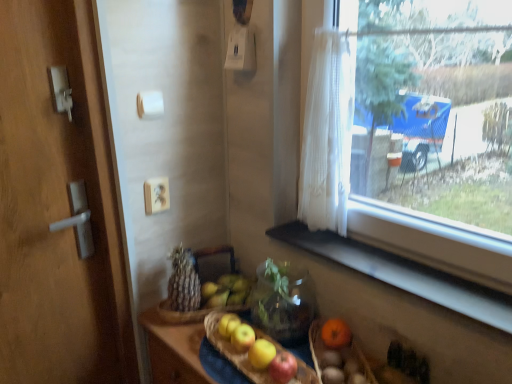
Question: Is there a large distance between black matte window sill at lower right and white sheer curtain at window?

Choices:
 (A) yes
 (B) no

Answer: (B)

Question: From a real-world perspective, does black matte window sill at lower right sit lower than white sheer curtain at window?

Choices:
 (A) yes
 (B) no

Answer: (A)

Question: Can you confirm if black matte window sill at lower right is positioned to the right of white sheer curtain at window?

Choices:
 (A) no
 (B) yes

Answer: (B)

Question: Can you confirm if black matte window sill at lower right is shorter than white sheer curtain at window?

Choices:
 (A) no
 (B) yes

Answer: (B)

Question: Does black matte window sill at lower right have a greater height compared to white sheer curtain at window?

Choices:
 (A) yes
 (B) no

Answer: (B)

Question: From the image's perspective, is brown textured bread at center positioned above or below black matte window sill at lower right?

Choices:
 (A) below
 (B) above

Answer: (A)

Question: Would you say brown textured bread at center is inside or outside black matte window sill at lower right?

Choices:
 (A) outside
 (B) inside

Answer: (A)

Question: Is point (184, 258) positioned closer to the camera than point (397, 268)?

Choices:
 (A) closer
 (B) farther

Answer: (B)

Question: Would you say brown textured bread at center is to the left or to the right of black matte window sill at lower right in the picture?

Choices:
 (A) left
 (B) right

Answer: (A)

Question: In the image, is matte brown wicker basket at lower right, the second basket when ordered from left to right, on the left side or the right side of brown textured bread at center?

Choices:
 (A) left
 (B) right

Answer: (B)

Question: From the image's perspective, is matte brown wicker basket at lower right, the 1th basket positioned from the right, above or below brown textured bread at center?

Choices:
 (A) above
 (B) below

Answer: (B)

Question: Is matte brown wicker basket at lower right, the 1th basket positioned from the right, taller or shorter than brown textured bread at center?

Choices:
 (A) short
 (B) tall

Answer: (A)

Question: Is matte brown wicker basket at lower right, the 1th basket positioned from the right, spatially inside brown textured bread at center, or outside of it?

Choices:
 (A) inside
 (B) outside

Answer: (B)

Question: Is black matte window sill at lower right spatially inside matte brown wicker basket at lower right, the 1th basket positioned from the right, or outside of it?

Choices:
 (A) outside
 (B) inside

Answer: (A)

Question: From the image's perspective, is black matte window sill at lower right above or below matte brown wicker basket at lower right, the 1th basket positioned from the right?

Choices:
 (A) above
 (B) below

Answer: (A)